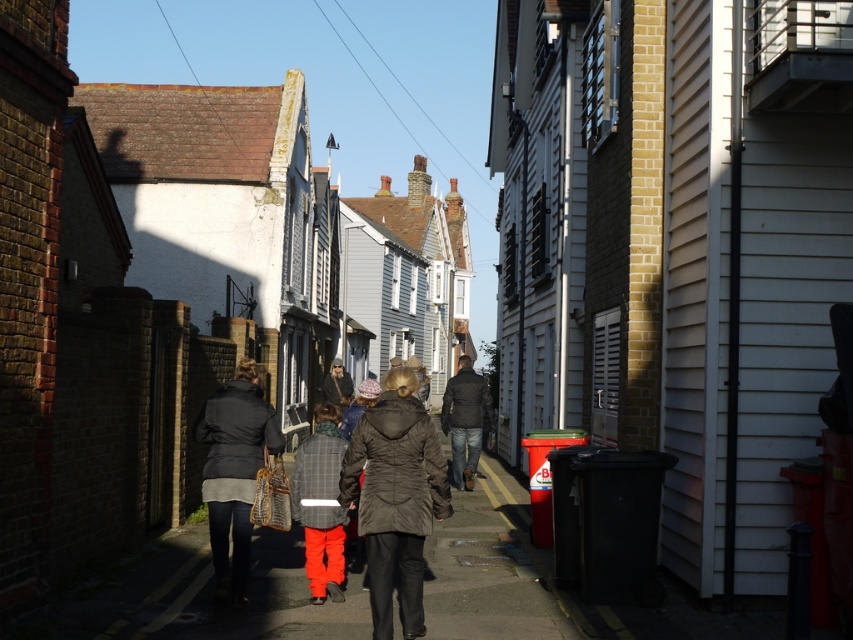
You are standing at the starting point in the alleyway and see the two points marked on the ground. Which point is closer to you, point (440,461) or point (259,440)?

Point (440,461) is in front of point (259,440), so it is closer to you.

You are standing at the entrance of the alley and see a group of people walking away from you. There is a point marked at coordinates (395, 497). Which object in the scene is this point located on?

The point at coordinates (395, 497) is located on the dark brown textured coat at center.

You are a photographer standing at the end of the alleyway. You want to capture a photo of the dark brown textured coat at center and the matte black jacket at center. Which one is positioned higher in the frame?

The dark brown textured coat at center is positioned higher in the frame than the matte black jacket at center.